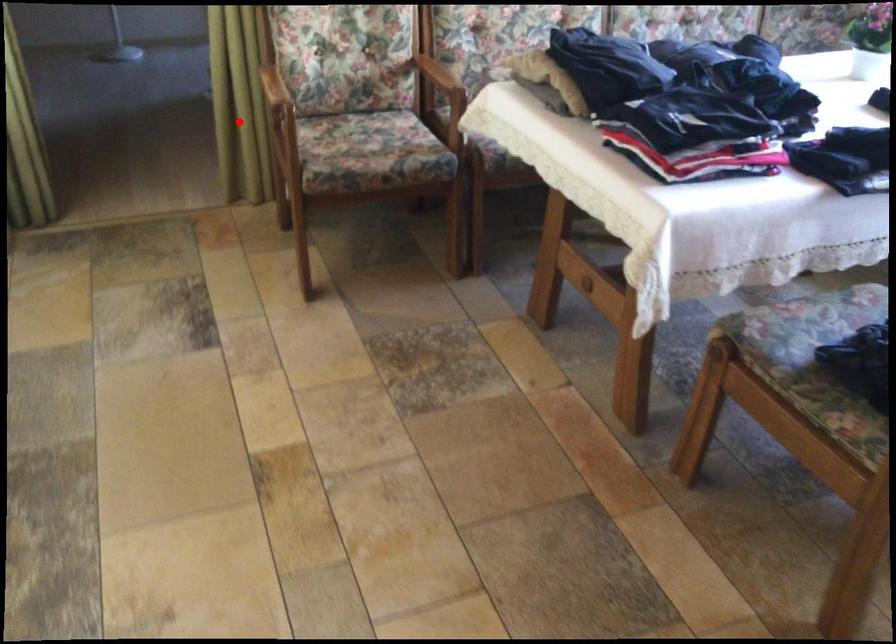
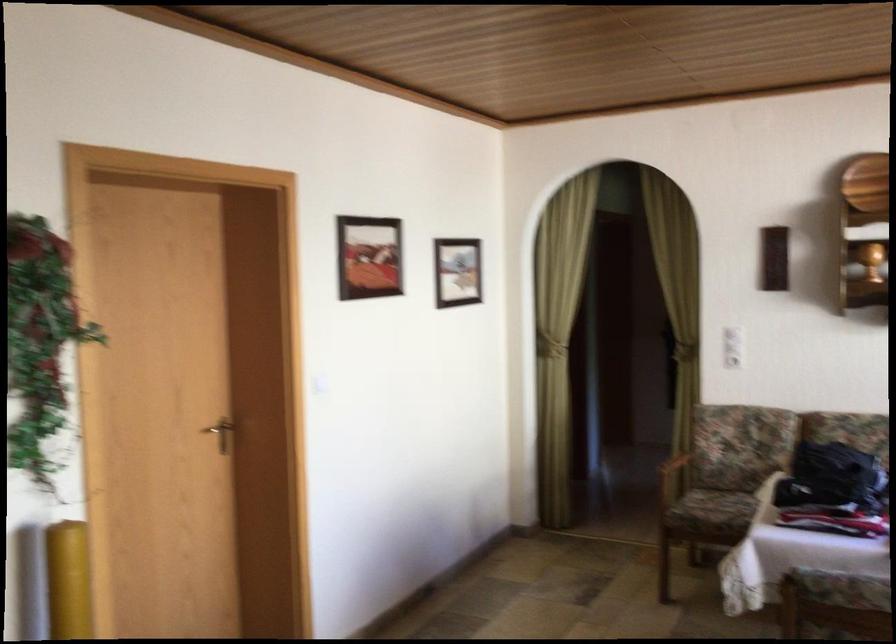
Question: A red point is marked in image1. In image2, is the corresponding 3D point closer to the camera or farther? Reply with the corresponding letter.

Choices:
 (A) The corresponding 3D point is closer.
 (B) The corresponding 3D point is farther.

Answer: (B)